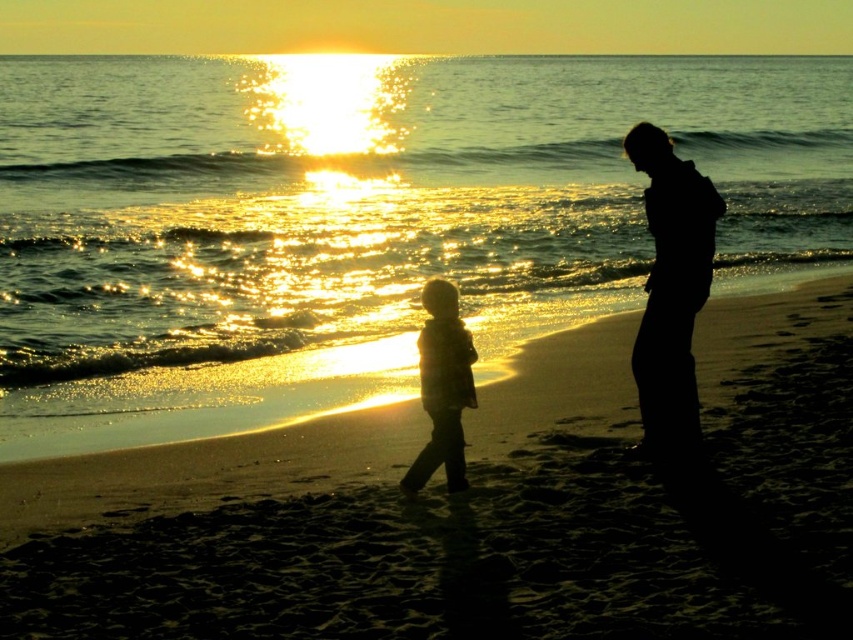
You are a photographer trying to capture the sunset scene. You notice the shiny golden water at center and the silhouette clothing at right. Which object would you focus on if you want to capture the widest part of the scene?

The shiny golden water at center is wider than the silhouette clothing at right, so focusing on the shiny golden water at center would capture the widest part of the scene.

You are standing at the point labeled as point (476, 509) in the image. What is the terrain like at that location?

The point (476, 509) indicates sandy beach at center, so the terrain at that location is sandy beach.